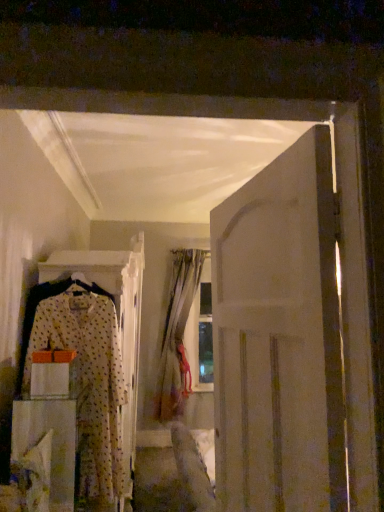
Question: In terms of height, does white fabric drawer at lower left look taller or shorter compared to silky beige curtain at center?

Choices:
 (A) short
 (B) tall

Answer: (A)

Question: From a real-world perspective, is white fabric drawer at lower left physically located above or below silky beige curtain at center?

Choices:
 (A) above
 (B) below

Answer: (B)

Question: Estimate the real-world distances between objects in this image. Which object is farther from the polka dot fabric dress at left?

Choices:
 (A) silky beige curtain at center
 (B) white matte door at right
 (C) white fabric drawer at lower left

Answer: (A)

Question: Which of these objects is positioned farthest from the white matte door at right?

Choices:
 (A) white fabric drawer at lower left
 (B) silky beige curtain at center
 (C) polka dot fabric dress at left

Answer: (B)